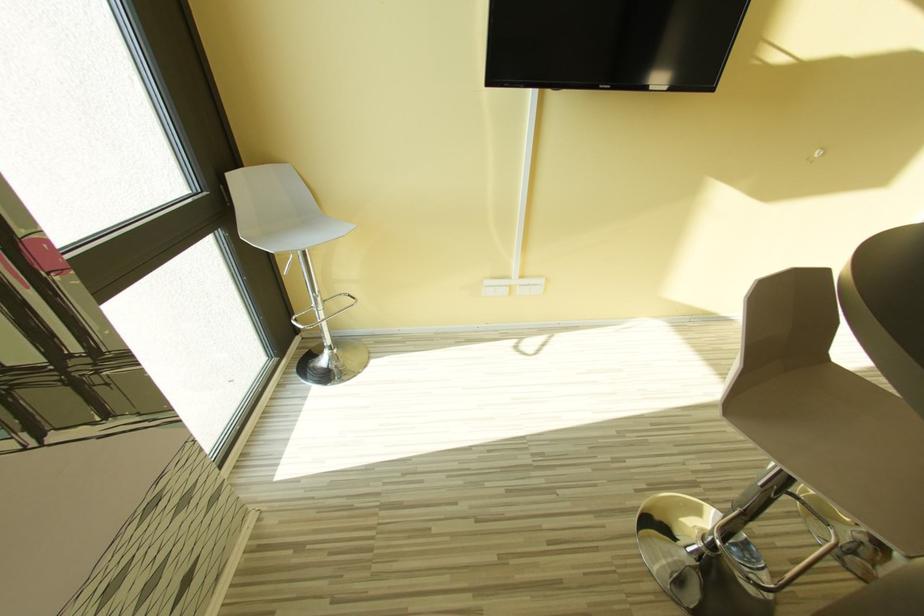
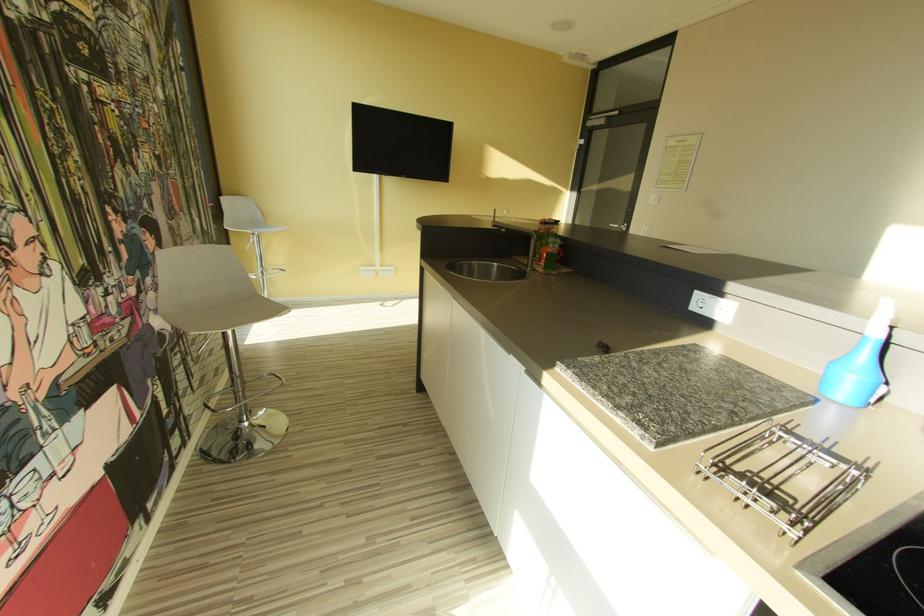
Question: Which direction would the cameraman need to move to produce the second image? Reply with the corresponding letter.

Choices:
 (A) Left
 (B) Right
 (C) Forward
 (D) Backward

Answer: (D)